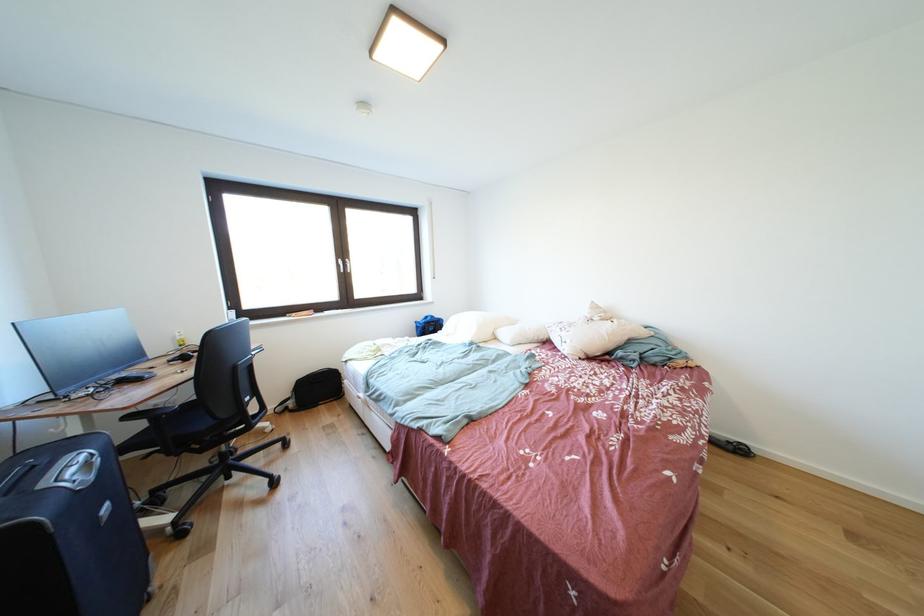
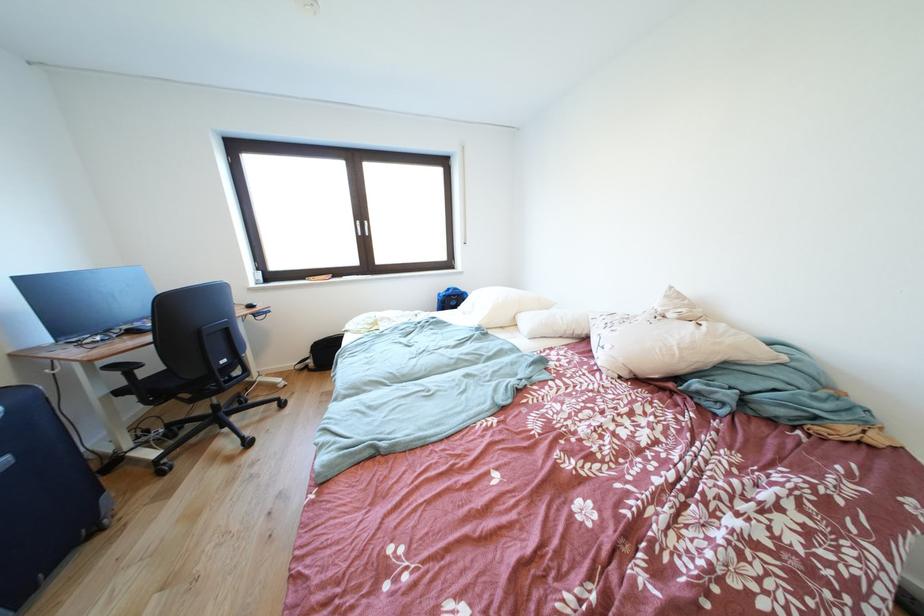
Question: The camera is either moving clockwise (left) or counter-clockwise (right) around the object. The first image is from the beginning of the video and the second image is from the end. Is the camera moving left or right when shooting the video?

Choices:
 (A) Left
 (B) Right

Answer: (B)